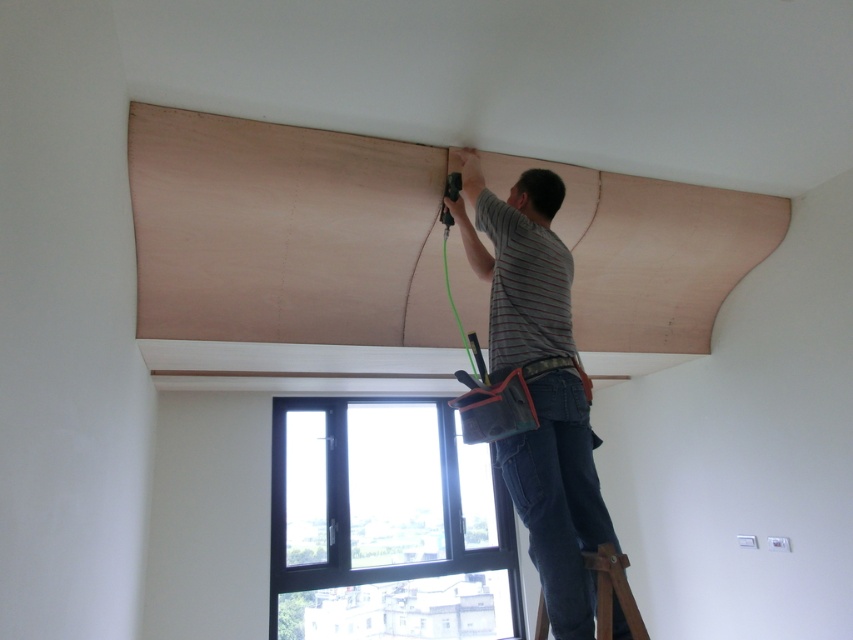
Question: Is natural wood plywood at upper center smaller than clear glass window at center?

Choices:
 (A) no
 (B) yes

Answer: (A)

Question: Which point is farther from the camera taking this photo?

Choices:
 (A) (593, 561)
 (B) (392, 221)
 (C) (433, 525)

Answer: (C)

Question: Which point is closer to the camera taking this photo?

Choices:
 (A) (364, 403)
 (B) (540, 323)
 (C) (173, 310)
 (D) (631, 637)

Answer: (D)

Question: Is natural wood plywood at upper center in front of striped cotton shirt at upper center?

Choices:
 (A) yes
 (B) no

Answer: (B)

Question: Does natural wood plywood at upper center have a greater width compared to brown leather ladder at lower right?

Choices:
 (A) yes
 (B) no

Answer: (A)

Question: Which of the following is the closest to the observer?

Choices:
 (A) natural wood plywood at upper center
 (B) striped cotton shirt at upper center
 (C) clear glass window at center

Answer: (B)